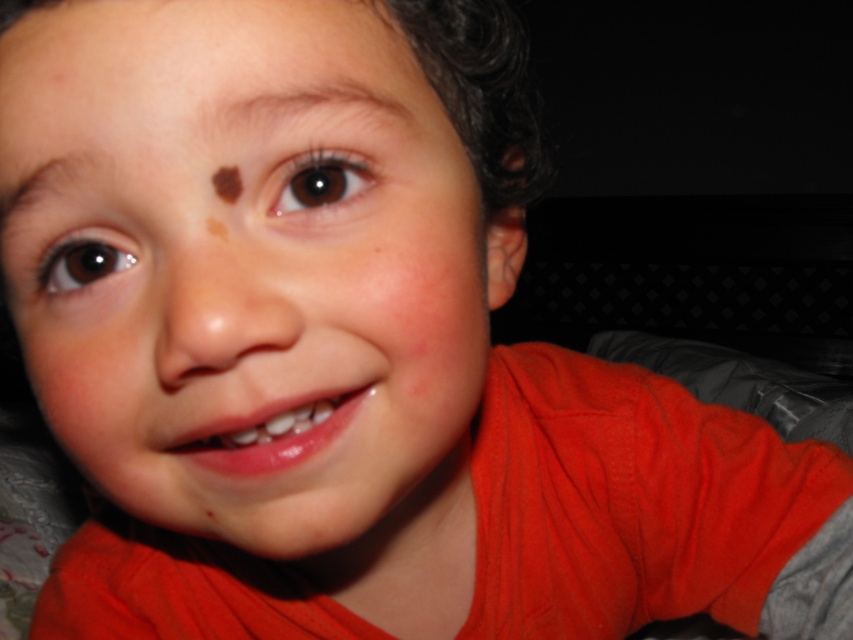
You are a photographer adjusting lighting for a portrait. You need to ensure that the brown skin at upper center and the brown shiny eye at upper right are both well illuminated. Based on their sizes in the image, which area requires a wider light source to cover adequately?

The brown skin at upper center requires a wider light source because it has a greater height compared to the brown shiny eye at upper right, so it needs more coverage to ensure proper illumination.

Looking at the child in the image, where is the brown shiny eye at left in relation to the brown skin at upper center?

The brown shiny eye at left is to the left of the brown skin at upper center.

Based on the scene description, where is the smooth skin face at center located in relation to the brown smooth eyebrow at upper center?

The smooth skin face at center is located to the left of the brown smooth eyebrow at upper center.